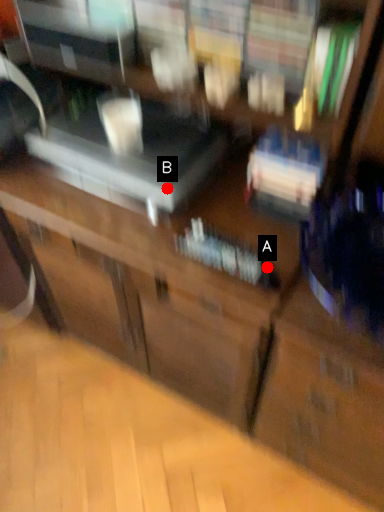
Question: Two points are circled on the image, labeled by A and B beside each circle. Which of the following is the farthest from the observer?

Choices:
 (A) A is further
 (B) B is further

Answer: (B)